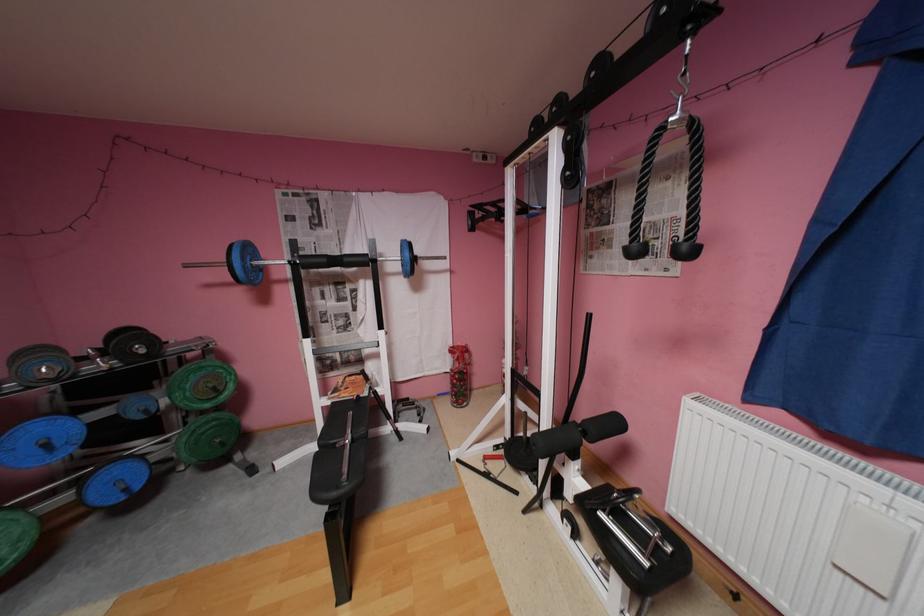
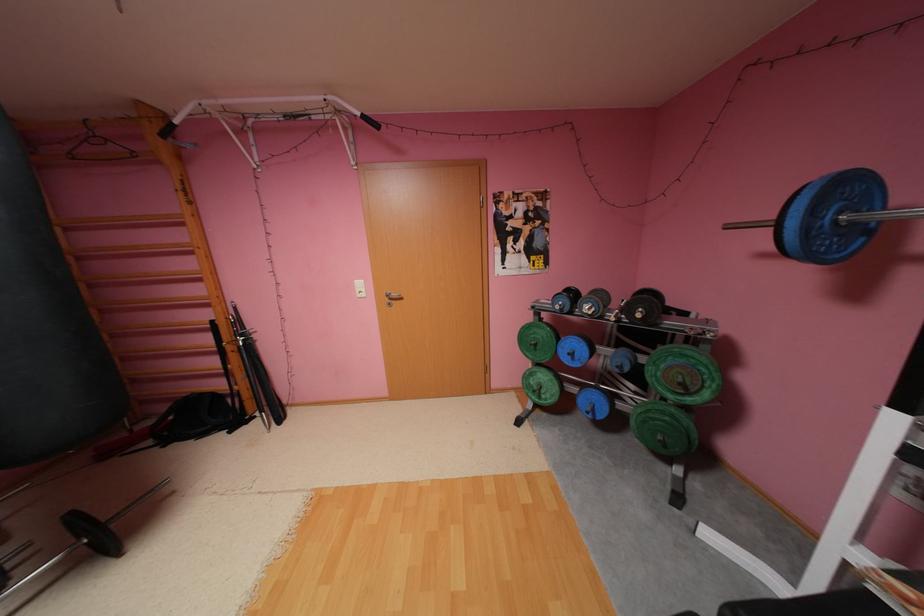
In the second image, find the point that corresponds to pixel 63 379 in the first image.

(600, 315)